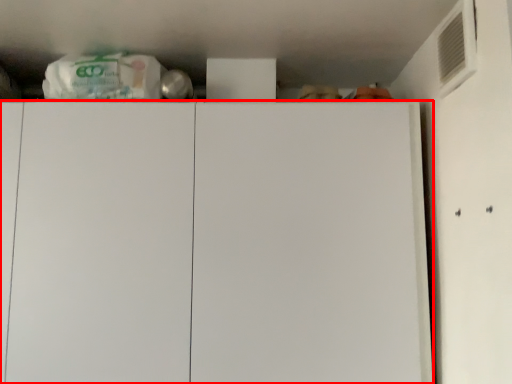
Question: From the image's perspective, what is the correct spatial positioning of cabinetry (annotated by the red box) in reference to air conditioning?

Choices:
 (A) below
 (B) above

Answer: (A)